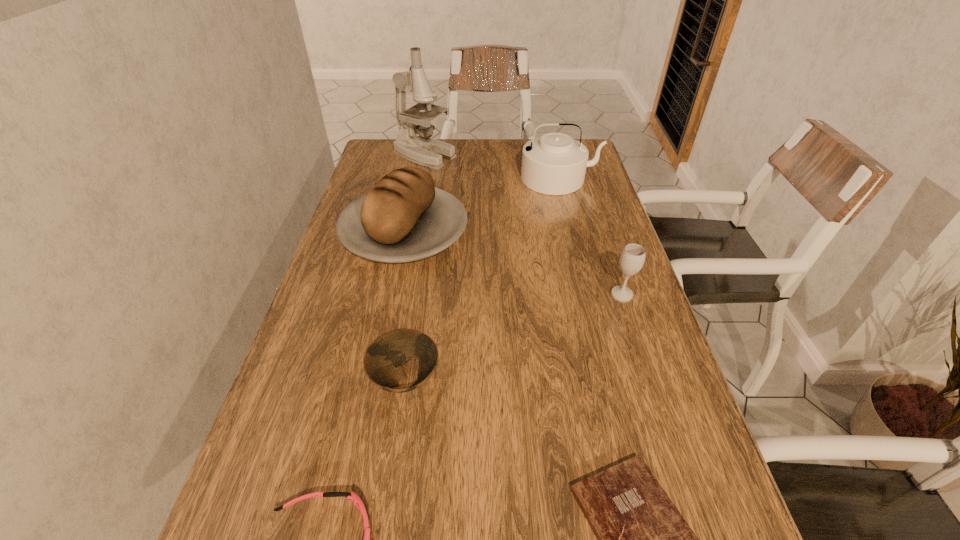
In the image, there is a desktop. Identify the location of vacant space at the far edge. The height and width of the screenshot is (540, 960). (468, 168).

In the image, there is a desktop. Where is `vacant area at the left edge`? vacant area at the left edge is located at coordinates tap(345, 263).

Locate an element on the screen. The height and width of the screenshot is (540, 960). free space at the right edge of the desktop is located at coordinates (584, 304).

In the image, there is a desktop. Identify the location of free space at the far left corner. click(x=407, y=164).

This screenshot has height=540, width=960. I want to click on vacant area between the tallest object and the bowl, so click(415, 268).

Identify the location of vacant region between the fourth tallest object and the microscope. The image size is (960, 540). (523, 226).

Where is `free space between the kettle and the fourth farthest object`? free space between the kettle and the fourth farthest object is located at coordinates (590, 237).

You are a GUI agent. You are given a task and a screenshot of the screen. Output one action in this format:
    pyautogui.click(x=<x>, y=<y>)
    Task: Click on the vacant area between the bowl and the microscope
    The height and width of the screenshot is (540, 960).
    Given the screenshot: What is the action you would take?
    pyautogui.click(x=415, y=268)

I want to click on free space between the kettle and the bread, so click(482, 206).

Identify which object is the third nearest to the goggles. Please provide its 2D coordinates. Your answer should be formatted as a tuple, i.e. [(x, y)], where the tuple contains the x and y coordinates of a point satisfying the conditions above.

[(403, 217)]